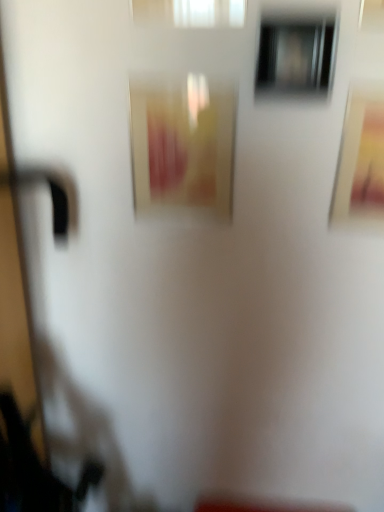
Question: Is matte gold picture frame at upper right, which is the 1th picture frame from right to left, at the right side of matte yellow picture frame at center, placed as the second picture frame when sorted from right to left?

Choices:
 (A) yes
 (B) no

Answer: (A)

Question: From the image's perspective, does matte gold picture frame at upper right, placed as the second picture frame when sorted from left to right, appear lower than matte yellow picture frame at center, placed as the second picture frame when sorted from right to left?

Choices:
 (A) no
 (B) yes

Answer: (B)

Question: Is matte gold picture frame at upper right, placed as the second picture frame when sorted from left to right, positioned in front of matte yellow picture frame at center, placed as the second picture frame when sorted from right to left?

Choices:
 (A) yes
 (B) no

Answer: (A)

Question: Does matte gold picture frame at upper right, which is the 1th picture frame from right to left, have a larger size compared to matte yellow picture frame at center, placed as the second picture frame when sorted from right to left?

Choices:
 (A) yes
 (B) no

Answer: (B)

Question: Is matte gold picture frame at upper right, placed as the second picture frame when sorted from left to right, touching matte yellow picture frame at center, placed as the second picture frame when sorted from right to left?

Choices:
 (A) no
 (B) yes

Answer: (A)

Question: Is white translucent curtain at upper center, acting as the 2th window starting from the bottom, bigger or smaller than matte yellow picture frame at center, placed as the second picture frame when sorted from right to left?

Choices:
 (A) small
 (B) big

Answer: (A)

Question: Is point (210, 5) closer or farther from the camera than point (188, 74)?

Choices:
 (A) farther
 (B) closer

Answer: (B)

Question: Is white translucent curtain at upper center, acting as the 2th window starting from the bottom, spatially inside matte yellow picture frame at center, the 1th picture frame positioned from the left, or outside of it?

Choices:
 (A) outside
 (B) inside

Answer: (A)

Question: From a real-world perspective, is white translucent curtain at upper center, the 1th window when ordered from left to right, physically located above or below matte yellow picture frame at center, placed as the second picture frame when sorted from right to left?

Choices:
 (A) above
 (B) below

Answer: (A)

Question: Visually, is white translucent curtain at upper center, the 1th window when ordered from left to right, positioned to the left or to the right of transparent glass window at upper center, the 2th window in the left-to-right sequence?

Choices:
 (A) right
 (B) left

Answer: (B)

Question: Considering the positions of white translucent curtain at upper center, the 1th window viewed from the top, and transparent glass window at upper center, the 2th window in the left-to-right sequence, in the image, is white translucent curtain at upper center, the 1th window viewed from the top, wider or thinner than transparent glass window at upper center, the 2th window in the left-to-right sequence,?

Choices:
 (A) thin
 (B) wide

Answer: (A)

Question: From the image's perspective, is white translucent curtain at upper center, the 1th window viewed from the top, above or below transparent glass window at upper center, the 1th window in the right-to-left sequence?

Choices:
 (A) below
 (B) above

Answer: (B)

Question: Is white translucent curtain at upper center, acting as the 2th window starting from the bottom, inside or outside of transparent glass window at upper center, marked as the second window in a top-to-bottom arrangement?

Choices:
 (A) inside
 (B) outside

Answer: (B)

Question: Which is correct: transparent glass window at upper center, the 1th window in the right-to-left sequence, is inside white translucent curtain at upper center, the 1th window when ordered from left to right, or outside of it?

Choices:
 (A) outside
 (B) inside

Answer: (A)

Question: Does point (319, 81) appear closer or farther from the camera than point (178, 8)?

Choices:
 (A) farther
 (B) closer

Answer: (A)